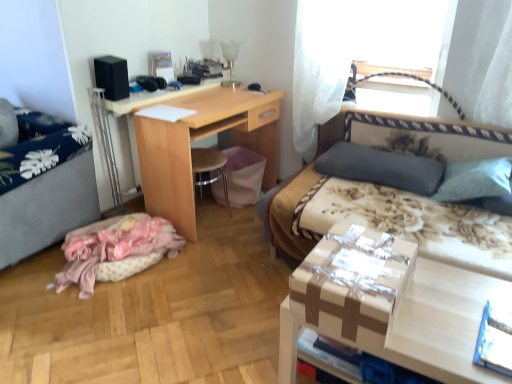
Identify the location of empty space that is ontop of dark gray fabric pillow at upper right. (374, 152).